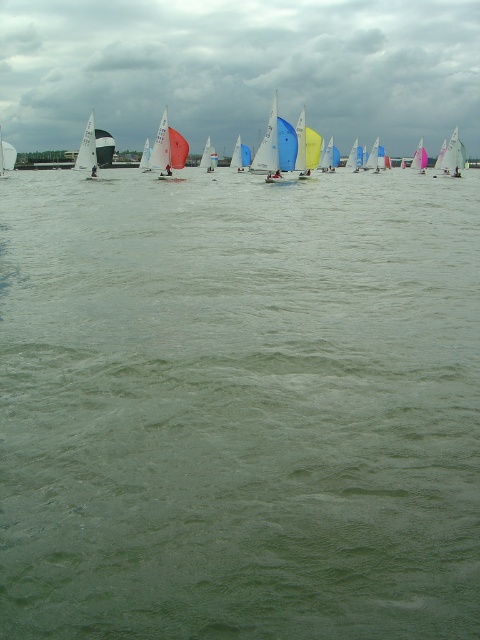
You are a spectator standing on the shore observing the sailboats. Which sailboat is closer to you, the white matte sailboat at left or the pink sailboat at upper center?

The white matte sailboat at left is closer to you because it is in front of the pink sailboat at upper center.

You are a sailor navigating a small boat in the middle of the regatta. You need to reach a specific point marked at coordinates point (239,408). According to the image, what will you encounter at that location?

The green water at center is located at point (239,408), so you will encounter green water at center at that location.